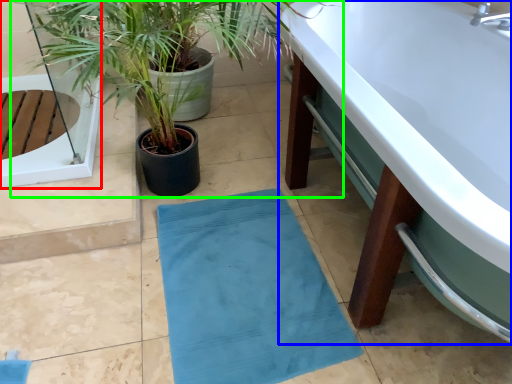
Question: Based on their relative distances, which object is farther from glass door (highlighted by a red box)? Choose from bathtub (highlighted by a blue box) and houseplant (highlighted by a green box).

Choices:
 (A) bathtub
 (B) houseplant

Answer: (A)